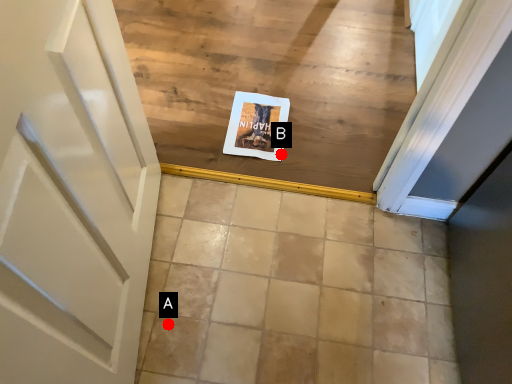
Question: Two points are circled on the image, labeled by A and B beside each circle. Which point appears farthest from the camera in this image?

Choices:
 (A) A is further
 (B) B is further

Answer: (B)